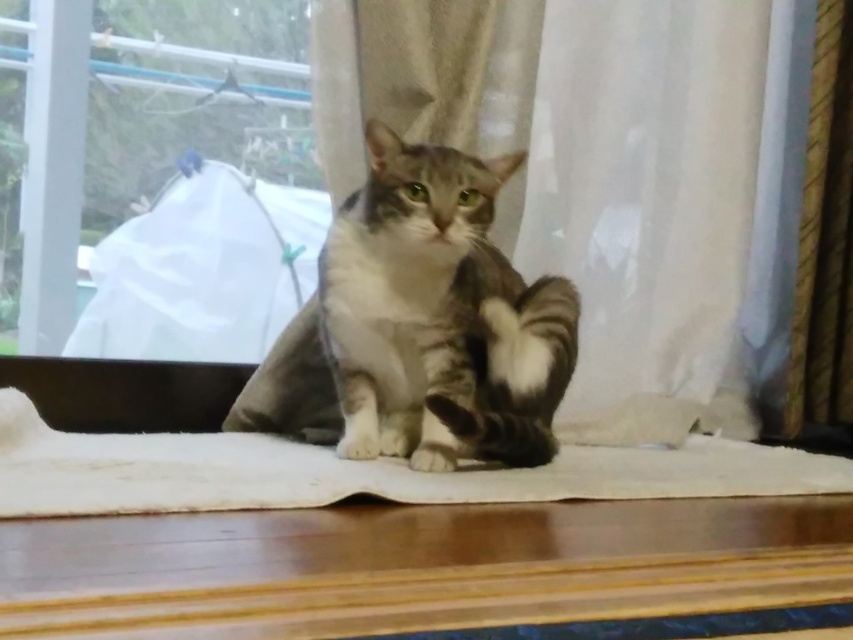
You are a small toy mouse that is 10 inches long. You are placed on the floor between the silky white curtain at center and the transparent plastic bag at left. Can you fit entirely between them without touching either?

The distance between the silky white curtain at center and the transparent plastic bag at left is 17.61 inches. Since the toy mouse is only 10 inches long, there is enough space for it to fit entirely between them without touching either object.

You are standing in a room with a cat on a light surface. There is a point at coordinates (165, 202). Can you tell me what object this point is located on?

The point at coordinates (165, 202) is located on the transparent plastic bag at left.

You are a delivery person who just arrived at the house. You see a transparent plastic bag at left and a gray tabby cat at center. Can you safely place a small package between them without it being knocked over by the cat?

The distance between the transparent plastic bag at left and the gray tabby cat at center is 16.42 inches. Since the package is small, it should fit safely in the space between them without being knocked over by the cat.